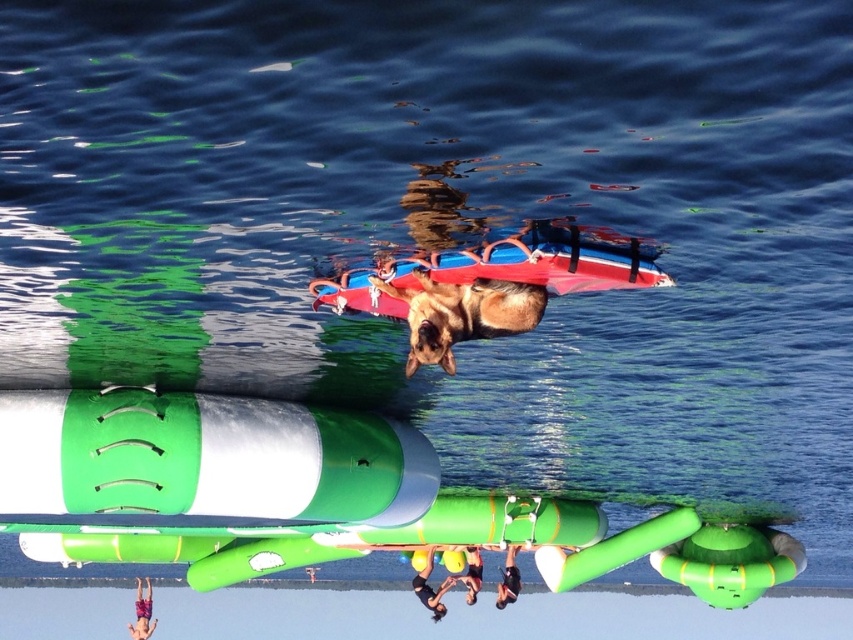
Is multicolored shorts at lower left shorter than yellow rubber ring at lower center?

Incorrect, multicolored shorts at lower left's height does not fall short of yellow rubber ring at lower center's.

Find the location of a particular element. This screenshot has width=853, height=640. multicolored shorts at lower left is located at coordinates (142, 611).

Can you confirm if red matte surfboard at center is wider than multicolored shorts at lower left?

Yes, red matte surfboard at center is wider than multicolored shorts at lower left.

Does point (566, 289) come closer to viewer compared to point (135, 595)?

Yes, point (566, 289) is closer to viewer.

The height and width of the screenshot is (640, 853). I want to click on red matte surfboard at center, so click(506, 268).

Looking at this image, does green matte cylinder at center appear on the right side of brown fur dog at center?

No, green matte cylinder at center is not to the right of brown fur dog at center.

Who is positioned more to the left, green matte cylinder at center or brown fur dog at center?

green matte cylinder at center

Image resolution: width=853 pixels, height=640 pixels. Describe the element at coordinates (207, 458) in the screenshot. I see `green matte cylinder at center` at that location.

I want to click on green matte cylinder at center, so click(207, 458).